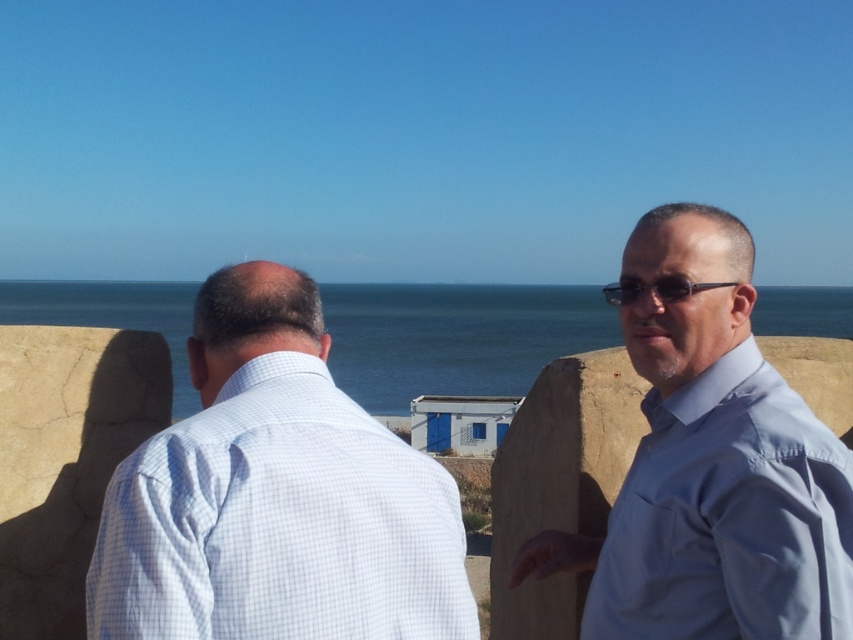
Question: Which object is closer to the camera taking this photo?

Choices:
 (A) blue glossy shirt at right
 (B) blue water at center
 (C) white checkered shirt at left

Answer: (C)

Question: Is blue water at center further to the viewer compared to black plastic sunglasses at right?

Choices:
 (A) no
 (B) yes

Answer: (B)

Question: Which of these objects is positioned farthest from the white checkered shirt at left?

Choices:
 (A) blue glossy shirt at right
 (B) black plastic sunglasses at right

Answer: (B)

Question: Can you confirm if blue water at center is bigger than black plastic sunglasses at right?

Choices:
 (A) no
 (B) yes

Answer: (B)

Question: Is white checkered shirt at left behind black plastic sunglasses at right?

Choices:
 (A) no
 (B) yes

Answer: (A)

Question: Which object is positioned closest to the black plastic sunglasses at right?

Choices:
 (A) blue water at center
 (B) blue glossy shirt at right

Answer: (B)